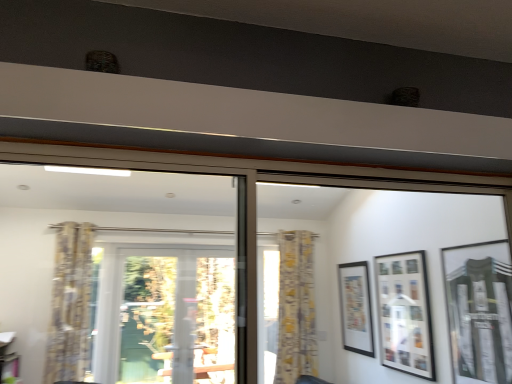
What do you see at coordinates (356, 308) in the screenshot? I see `matte black picture frame at center right, the 3th picture frame in the right-to-left sequence` at bounding box center [356, 308].

What do you see at coordinates (404, 313) in the screenshot? Image resolution: width=512 pixels, height=384 pixels. I see `matte black picture frame at center right, the second picture frame viewed from the right` at bounding box center [404, 313].

What do you see at coordinates (296, 308) in the screenshot? I see `yellow floral fabric curtain at center, the second curtain viewed from the front` at bounding box center [296, 308].

Identify the location of matte black picture frame at center right, the 1th picture frame when ordered from back to front. The height and width of the screenshot is (384, 512). (356, 308).

What are the coordinates of `curtain that is the 1st one below the black matte window frame at upper center (from a real-world perspective)` in the screenshot? It's located at (70, 304).

Would you consider yellow floral fabric curtain at left, positioned as the first curtain in front-to-back order, to be distant from black matte window frame at upper center?

Absolutely, yellow floral fabric curtain at left, positioned as the first curtain in front-to-back order, is distant from black matte window frame at upper center.

Which is in front, yellow floral fabric curtain at left, the first curtain in the left-to-right sequence, or black matte window frame at upper center?

Positioned in front is black matte window frame at upper center.

Who is smaller, yellow floral fabric curtain at left, the 2th curtain from the right, or black matte window frame at upper center?

black matte window frame at upper center.

Where is `screen door behind the matte black picture frame at center right, the 1th picture frame when ordered from back to front`? screen door behind the matte black picture frame at center right, the 1th picture frame when ordered from back to front is located at coordinates (177, 316).

From the image's perspective, is transparent glass screen door at center above or below matte black picture frame at center right, the 3th picture frame in the right-to-left sequence?

transparent glass screen door at center is situated lower than matte black picture frame at center right, the 3th picture frame in the right-to-left sequence, in the image.

From a real-world perspective, is transparent glass screen door at center above or below matte black picture frame at center right, the 1th picture frame when ordered from back to front?

transparent glass screen door at center is below matte black picture frame at center right, the 1th picture frame when ordered from back to front.

Would you say matte black picture frame at center right, which ranks as the first picture frame in left-to-right order, is to the left or to the right of yellow floral fabric curtain at left, the 2th curtain from the right, in the picture?

matte black picture frame at center right, which ranks as the first picture frame in left-to-right order, is positioned on yellow floral fabric curtain at left, the 2th curtain from the right,'s right side.

Is the depth of matte black picture frame at center right, the 3th picture frame in the right-to-left sequence, less than that of yellow floral fabric curtain at left, the 2th curtain from the right?

No.

The width and height of the screenshot is (512, 384). In order to click on the 2nd curtain above the matte black picture frame at center right, marked as the third picture frame in a front-to-back arrangement (from a real-world perspective) in this screenshot , I will do click(x=70, y=304).

Which of these two, matte black picture frame at center right, which ranks as the first picture frame in left-to-right order, or yellow floral fabric curtain at left, the 2th curtain from the right, is wider?

yellow floral fabric curtain at left, the 2th curtain from the right, is wider.

Between yellow floral fabric curtain at left, the 2th curtain when ordered from back to front, and matte black picture frame at center right, which is the 2th picture frame from back to front, which one has larger size?

Bigger between the two is yellow floral fabric curtain at left, the 2th curtain when ordered from back to front.

The width and height of the screenshot is (512, 384). I want to click on picture frame that is the 2nd one below the yellow floral fabric curtain at left, the 2th curtain when ordered from back to front (from a real-world perspective), so click(x=404, y=313).

Is yellow floral fabric curtain at left, the first curtain in the left-to-right sequence, facing away from matte black picture frame at center right, marked as the 2th picture frame in a front-to-back arrangement?

That's not correct — yellow floral fabric curtain at left, the first curtain in the left-to-right sequence, is not looking away from matte black picture frame at center right, marked as the 2th picture frame in a front-to-back arrangement.

Is matte black picture frame at center right, marked as the 2th picture frame in a front-to-back arrangement, positioned with its back to matte glass picture frame at right, marked as the 3th picture frame in a back-to-front arrangement?

matte black picture frame at center right, marked as the 2th picture frame in a front-to-back arrangement, does not have its back to matte glass picture frame at right, marked as the 3th picture frame in a back-to-front arrangement.

From a real-world perspective, is matte black picture frame at center right, which is the 2th picture frame from back to front, physically above matte glass picture frame at right, the first picture frame from the right?

No, from a real-world perspective, matte black picture frame at center right, which is the 2th picture frame from back to front, is not on top of matte glass picture frame at right, the first picture frame from the right.

Does matte black picture frame at center right, which is the 2th picture frame from back to front, have a lesser width compared to matte glass picture frame at right, which is the first picture frame from front to back?

Correct, the width of matte black picture frame at center right, which is the 2th picture frame from back to front, is less than that of matte glass picture frame at right, which is the first picture frame from front to back.

Are matte black picture frame at center right, positioned as the second picture frame in left-to-right order, and yellow floral fabric curtain at left, the 2th curtain when ordered from back to front, located far from each other?

matte black picture frame at center right, positioned as the second picture frame in left-to-right order, is far away from yellow floral fabric curtain at left, the 2th curtain when ordered from back to front.

Which is more to the right, matte black picture frame at center right, which is the 2th picture frame from back to front, or yellow floral fabric curtain at left, the 2th curtain from the right?

matte black picture frame at center right, which is the 2th picture frame from back to front, is more to the right.

Which of these two, matte black picture frame at center right, which is the 2th picture frame from back to front, or yellow floral fabric curtain at left, the 2th curtain when ordered from back to front, is smaller?

matte black picture frame at center right, which is the 2th picture frame from back to front.

In the image, is matte black picture frame at center right, the second picture frame viewed from the right, positioned in front of or behind yellow floral fabric curtain at left, positioned as the first curtain in front-to-back order?

Visually, matte black picture frame at center right, the second picture frame viewed from the right, is located in front of yellow floral fabric curtain at left, positioned as the first curtain in front-to-back order.

From the image's perspective, is yellow floral fabric curtain at left, the 2th curtain from the right, under yellow floral fabric curtain at center, placed as the 2th curtain when sorted from left to right?

Incorrect, from the image's perspective, yellow floral fabric curtain at left, the 2th curtain from the right, is higher than yellow floral fabric curtain at center, placed as the 2th curtain when sorted from left to right.

Can you confirm if yellow floral fabric curtain at left, the 2th curtain from the right, is thinner than yellow floral fabric curtain at center, placed as the first curtain when sorted from right to left?

In fact, yellow floral fabric curtain at left, the 2th curtain from the right, might be wider than yellow floral fabric curtain at center, placed as the first curtain when sorted from right to left.

From a real-world perspective, is yellow floral fabric curtain at left, the first curtain in the left-to-right sequence, over yellow floral fabric curtain at center, the second curtain viewed from the front?

Correct, in the physical world, yellow floral fabric curtain at left, the first curtain in the left-to-right sequence, is higher than yellow floral fabric curtain at center, the second curtain viewed from the front.

Considering the sizes of objects yellow floral fabric curtain at left, positioned as the first curtain in front-to-back order, and yellow floral fabric curtain at center, placed as the 1th curtain when sorted from back to front, in the image provided, who is smaller, yellow floral fabric curtain at left, positioned as the first curtain in front-to-back order, or yellow floral fabric curtain at center, placed as the 1th curtain when sorted from back to front,?

yellow floral fabric curtain at center, placed as the 1th curtain when sorted from back to front.

At what (x,y) coordinates should I click in order to perform the action: click on window frame that appears above the yellow floral fabric curtain at left, the 2th curtain when ordered from back to front (from a real-world perspective). Please return your answer as a coordinate pair (x, y). This screenshot has width=512, height=384. Looking at the image, I should click on [x=376, y=254].

The width and height of the screenshot is (512, 384). Identify the location of the 1st picture frame above when counting from the transparent glass screen door at center (from the image's perspective). (356, 308).

Considering their positions, is matte black picture frame at center right, which ranks as the first picture frame in left-to-right order, positioned closer to transparent glass screen door at center than matte glass picture frame at right, which ranks as the 3th picture frame in left-to-right order?

matte black picture frame at center right, which ranks as the first picture frame in left-to-right order, lies closer to transparent glass screen door at center than the other object.

Looking at the image, which one is located further to black matte window frame at upper center, yellow floral fabric curtain at center, placed as the 1th curtain when sorted from back to front, or matte glass picture frame at right, which ranks as the 3th picture frame in left-to-right order?

Based on the image, matte glass picture frame at right, which ranks as the 3th picture frame in left-to-right order, appears to be further to black matte window frame at upper center.

Looking at the image, which one is located closer to matte black picture frame at center right, the second picture frame viewed from the right, matte black picture frame at center right, marked as the third picture frame in a front-to-back arrangement, or yellow floral fabric curtain at left, the 2th curtain when ordered from back to front?

Among the two, matte black picture frame at center right, marked as the third picture frame in a front-to-back arrangement, is located nearer to matte black picture frame at center right, the second picture frame viewed from the right.

When comparing their distances from matte black picture frame at center right, the second picture frame viewed from the right, does black matte window frame at upper center or yellow floral fabric curtain at center, placed as the 1th curtain when sorted from back to front, seem closer?

black matte window frame at upper center lies closer to matte black picture frame at center right, the second picture frame viewed from the right, than the other object.

From the image, which object appears to be nearer to yellow floral fabric curtain at left, the first curtain in the left-to-right sequence, matte black picture frame at center right, which is the 2th picture frame from back to front, or black matte window frame at upper center?

Among the two, black matte window frame at upper center is located nearer to yellow floral fabric curtain at left, the first curtain in the left-to-right sequence.

Consider the image. Based on their spatial positions, is yellow floral fabric curtain at left, the 2th curtain when ordered from back to front, or matte glass picture frame at right, which ranks as the 3th picture frame in left-to-right order, further from black matte window frame at upper center?

yellow floral fabric curtain at left, the 2th curtain when ordered from back to front.

Based on their spatial positions, is transparent glass screen door at center or matte glass picture frame at right, the first picture frame from the right, further from yellow floral fabric curtain at left, positioned as the first curtain in front-to-back order?

matte glass picture frame at right, the first picture frame from the right, lies further to yellow floral fabric curtain at left, positioned as the first curtain in front-to-back order, than the other object.

From the image, which object appears to be farther from yellow floral fabric curtain at left, the 2th curtain from the right, black matte window frame at upper center or matte black picture frame at center right, marked as the 2th picture frame in a front-to-back arrangement?

matte black picture frame at center right, marked as the 2th picture frame in a front-to-back arrangement, lies further to yellow floral fabric curtain at left, the 2th curtain from the right, than the other object.

The width and height of the screenshot is (512, 384). Identify the location of window frame located between yellow floral fabric curtain at left, the first curtain in the left-to-right sequence, and matte glass picture frame at right, marked as the 3th picture frame in a back-to-front arrangement, in the left-right direction. (376, 254).

Find the location of `screen door between black matte window frame at upper center and yellow floral fabric curtain at center, placed as the 1th curtain when sorted from back to front, in the front-back direction`. screen door between black matte window frame at upper center and yellow floral fabric curtain at center, placed as the 1th curtain when sorted from back to front, in the front-back direction is located at coordinates (177, 316).

Where is `curtain located between black matte window frame at upper center and transparent glass screen door at center in the depth direction`? The width and height of the screenshot is (512, 384). curtain located between black matte window frame at upper center and transparent glass screen door at center in the depth direction is located at coordinates (70, 304).

Image resolution: width=512 pixels, height=384 pixels. I want to click on curtain located between transparent glass screen door at center and matte black picture frame at center right, which is the 2th picture frame from back to front, in the left-right direction, so click(x=296, y=308).